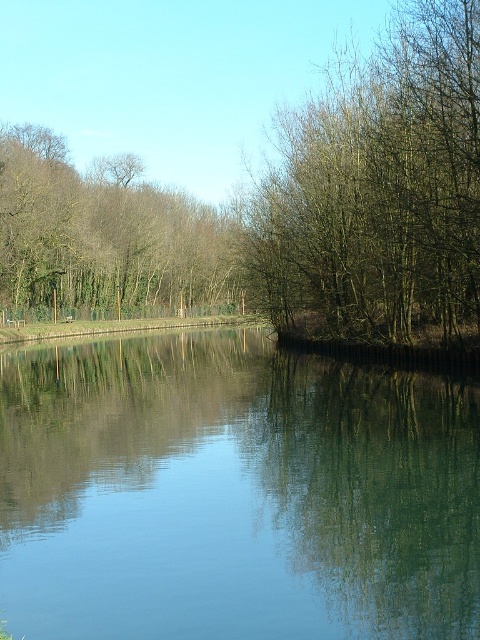
You are standing at the point marked as point (7, 440) in the image. The water surface is calm and you want to cross it to reach the trees on the opposite side. Can you safely walk across the water? Explain your reasoning based on the scene description.

The water surface is calm with gentle ripples, but the scene description does not mention the depth of the water or the presence of a path or bridge. Therefore, it is unclear if the water is shallow enough or if there is a safe route to cross to the trees on the opposite side.

You are standing at the edge of the waterway and see the point marked as point (233, 492). What is the nature of the surface at that point?

The surface at point (233, 492) is transparent water at center, as indicated by the Objects Description.

You are standing at the edge of the water and want to throw a small pebble into the transparent water at center. If you can throw the pebble 25 feet, will it land in the water?

The transparent water at center is 23.75 feet away from the viewer. Since the viewer can throw the pebble 25 feet, which is farther than the distance to the water, the pebble will land in the transparent water at center.